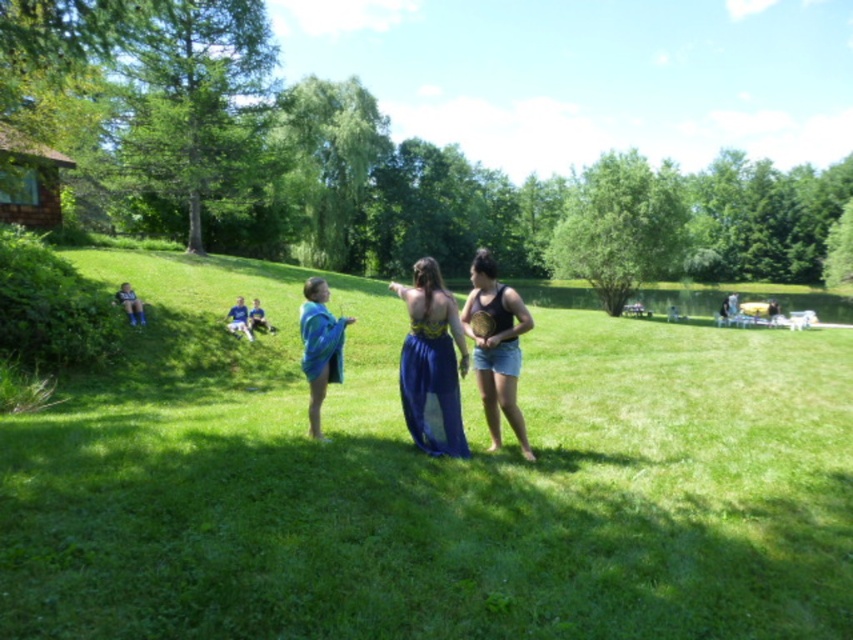
Question: Which point appears farthest from the camera in this image?

Choices:
 (A) (241, 506)
 (B) (126, 305)
 (C) (531, 451)

Answer: (B)

Question: Does blue satin dress at center appear under black matte tank top at center?

Choices:
 (A) no
 (B) yes

Answer: (B)

Question: Which of the following is the farthest from the observer?

Choices:
 (A) black matte tank top at center
 (B) blue denim shorts at lower left

Answer: (B)

Question: Is black matte tank top at center above blue denim shorts at lower left?

Choices:
 (A) no
 (B) yes

Answer: (B)

Question: Which point is closer to the camera?

Choices:
 (A) (491, 356)
 (B) (119, 300)
 (C) (403, 416)
 (D) (132, 355)

Answer: (A)

Question: Is blue satin dress at center closer to the viewer compared to shiny blue dress at center?

Choices:
 (A) yes
 (B) no

Answer: (A)